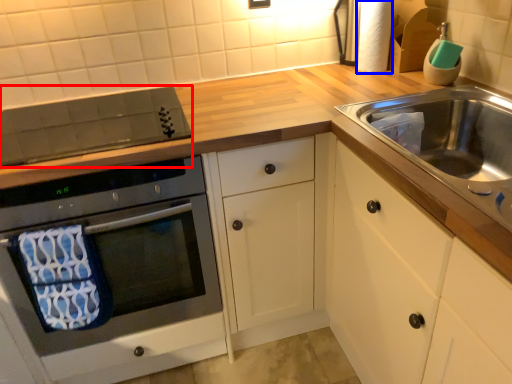
Question: Which point is closer to the camera, appliance (highlighted by a red box) or toilet paper (highlighted by a blue box)?

Choices:
 (A) appliance
 (B) toilet paper

Answer: (A)